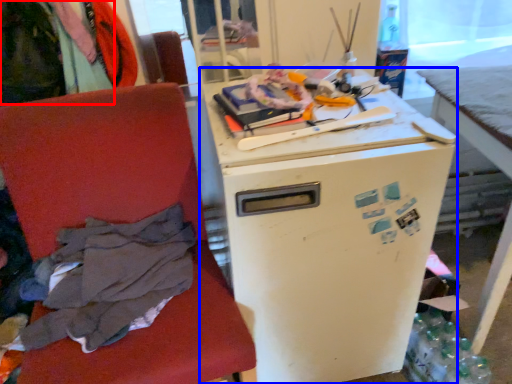
Question: Which object is further to the camera taking this photo, clothing (highlighted by a red box) or refrigerator (highlighted by a blue box)?

Choices:
 (A) clothing
 (B) refrigerator

Answer: (A)